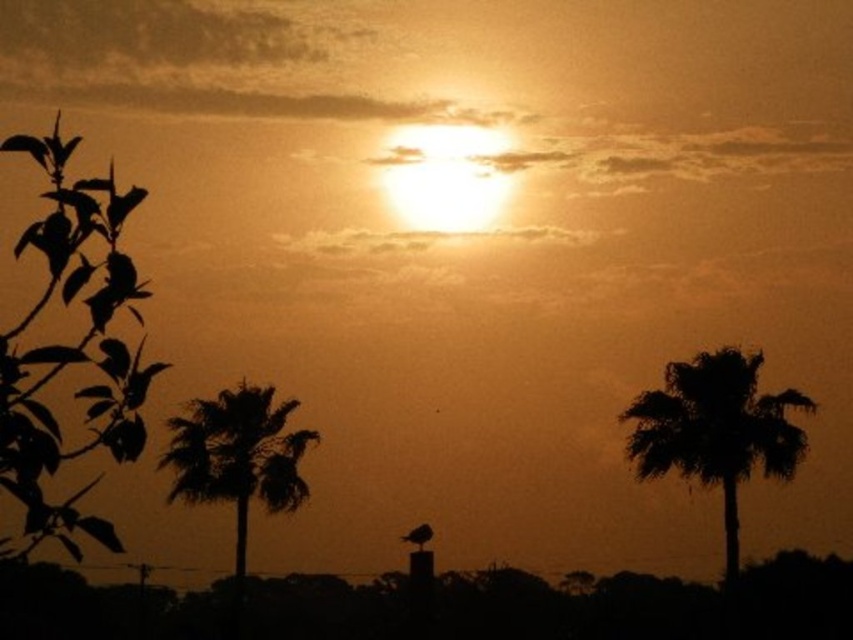
You are a photographer trying to capture the sunset scene. You notice two plants in the foreground. Which one is taller between the green leafy plant at left and the silhouette palm tree at left?

The green leafy plant at left is taller than the silhouette palm tree at left.

You are a photographer trying to capture the sunset. You see the green leafy plant at left and the silhouette palm tree at right. Which object is located to the left of the other?

The green leafy plant at left is positioned on the left side of the silhouette palm tree at right.

You are standing in the scene and want to reach the point at coordinates point (784,403). If your walking speed is 3 feet per second, how many seconds will it take you to reach the point?

The point (784,403) is 172.29 feet from the viewer. At a walking speed of 3 feet per second, it would take 172.29 divided by 3, which is approximately 57.43 seconds to reach the point.